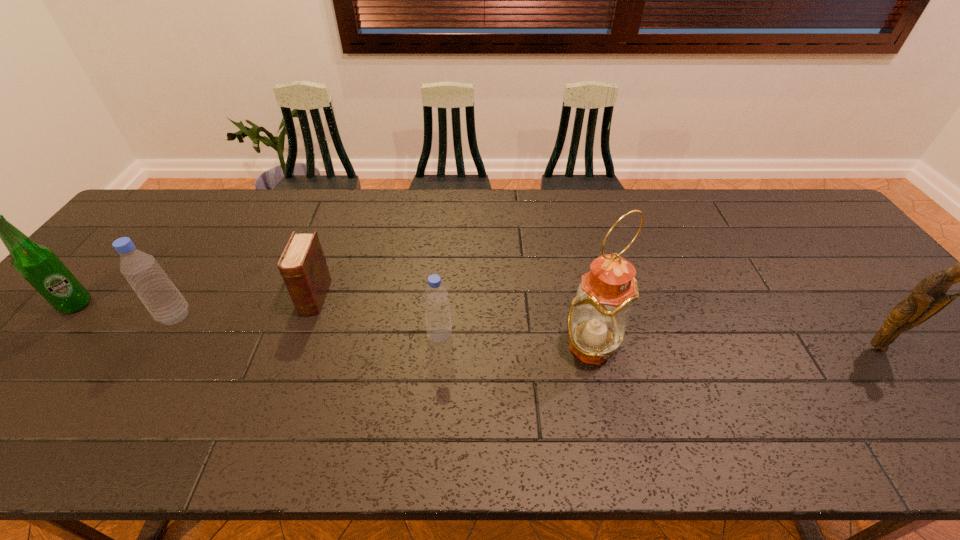
In the image, there is a desktop. Identify the location of blank space at the far left corner. (x=169, y=208).

At what (x,y) coordinates should I click in order to perform the action: click on free space at the far right corner of the desktop. Please return your answer as a coordinate pair (x, y). Looking at the image, I should click on (795, 210).

Where is `vacant space that is in between the fourth object from right to left and the shorter bottle`? The image size is (960, 540). vacant space that is in between the fourth object from right to left and the shorter bottle is located at coordinates (377, 316).

The image size is (960, 540). Find the location of `vacant space that's between the taller bottle and the tallest object`. vacant space that's between the taller bottle and the tallest object is located at coordinates (383, 332).

You are a GUI agent. You are given a task and a screenshot of the screen. Output one action in this format:
    pyautogui.click(x=<x>, y=<y>)
    Task: Click on the vacant point located between the beer bottle and the second object from left to right
    The width and height of the screenshot is (960, 540).
    Given the screenshot: What is the action you would take?
    pyautogui.click(x=126, y=310)

Find the location of a particular element. This screenshot has height=540, width=960. blank region between the second object from right to left and the fifth object from right to left is located at coordinates (383, 332).

The height and width of the screenshot is (540, 960). What are the coordinates of `empty location between the second object from left to right and the figurine` in the screenshot? It's located at (526, 332).

Find the location of a particular element. The height and width of the screenshot is (540, 960). free space between the figurine and the leftmost object is located at coordinates (476, 326).

I want to click on vacant space in between the shorter bottle and the third object from left to right, so 377,316.

The image size is (960, 540). I want to click on vacant point located between the left bottle and the beer bottle, so (126, 310).